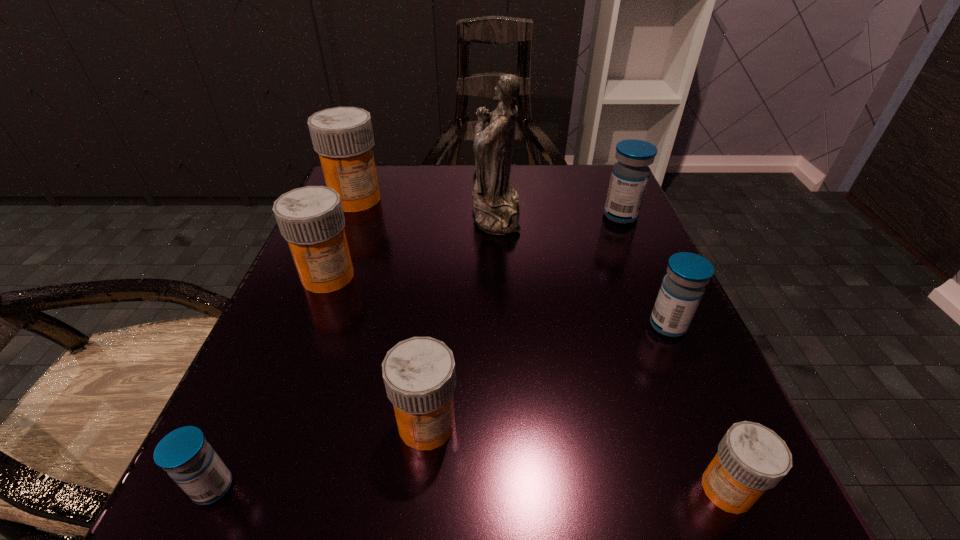
Locate an element on the screen. The height and width of the screenshot is (540, 960). vacant space that is in between the second nearest orange medicine and the smallest blue medicine is located at coordinates (320, 456).

Identify the location of free space that is in between the second orange medicine from right to left and the smallest orange medicine. Image resolution: width=960 pixels, height=540 pixels. (577, 457).

Identify the location of empty space that is in between the leftmost blue medicine and the second nearest orange medicine. (320, 456).

Image resolution: width=960 pixels, height=540 pixels. I want to click on vacant area that lies between the smallest blue medicine and the third smallest orange medicine, so click(x=271, y=382).

The width and height of the screenshot is (960, 540). What are the coordinates of `free space between the leftmost blue medicine and the second smallest orange medicine` in the screenshot? It's located at (320, 456).

You are a GUI agent. You are given a task and a screenshot of the screen. Output one action in this format:
    pyautogui.click(x=<x>, y=<y>)
    Task: Click on the free spot between the fourth object from right to left and the smallest blue medicine
    The width and height of the screenshot is (960, 540).
    Given the screenshot: What is the action you would take?
    pyautogui.click(x=354, y=350)

Point out which object is positioned as the fifth nearest to the rightmost orange medicine. Please provide its 2D coordinates. Your answer should be formatted as a tuple, i.e. [(x, y)], where the tuple contains the x and y coordinates of a point satisfying the conditions above.

[(184, 453)]

Where is `object that stands as the fifth closest to the tallest medicine`? Image resolution: width=960 pixels, height=540 pixels. object that stands as the fifth closest to the tallest medicine is located at coordinates (184, 453).

What are the coordinates of `the fifth closest medicine to the fifth farthest object` in the screenshot? It's located at (343, 137).

Locate an element on the screen. medicine that is the third closest one to the farthest orange medicine is located at coordinates (630, 175).